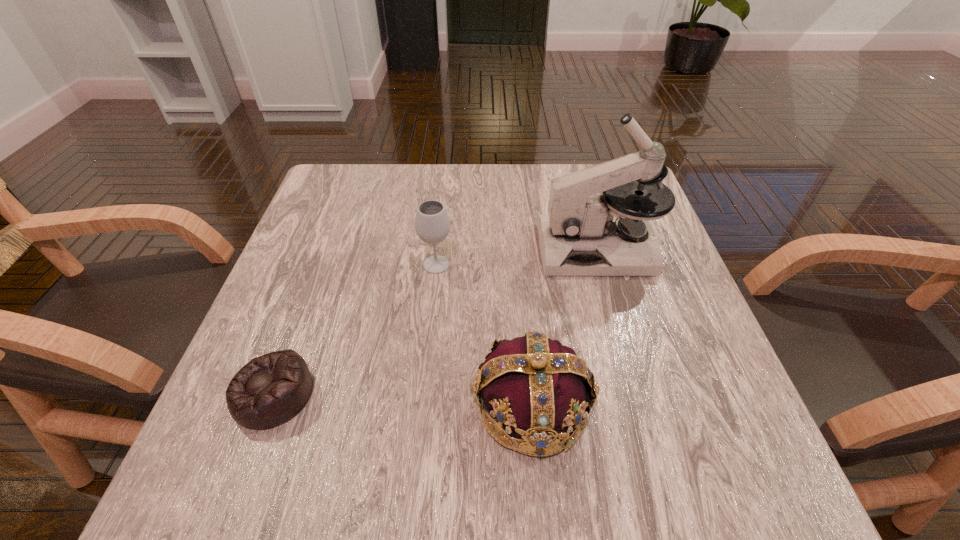
At what (x,y) coordinates should I click in order to perform the action: click on vacant space at the far right corner of the desktop. Please return your answer as a coordinate pair (x, y). The image size is (960, 540). Looking at the image, I should click on (585, 167).

The image size is (960, 540). Identify the location of blank space at the near right corner of the desktop. (660, 483).

Where is `free spot between the crown and the third object from right to left`? free spot between the crown and the third object from right to left is located at coordinates (484, 335).

Locate an element on the screen. This screenshot has width=960, height=540. free space between the microscope and the shortest object is located at coordinates point(436,321).

At what (x,y) coordinates should I click in order to perform the action: click on free area in between the microscope and the leftmost object. Please return your answer as a coordinate pair (x, y). The width and height of the screenshot is (960, 540). Looking at the image, I should click on (436, 321).

You are a GUI agent. You are given a task and a screenshot of the screen. Output one action in this format:
    pyautogui.click(x=<x>, y=<y>)
    Task: Click on the vacant area between the beanbag and the microscope
    The width and height of the screenshot is (960, 540).
    Given the screenshot: What is the action you would take?
    pyautogui.click(x=436, y=321)

In order to click on free space between the tallest object and the wineglass in this screenshot , I will do `click(516, 257)`.

Find the location of a particular element. Image resolution: width=960 pixels, height=540 pixels. vacant area between the leftmost object and the crown is located at coordinates (402, 399).

At what (x,y) coordinates should I click in order to perform the action: click on vacant area that lies between the wineglass and the tallest object. Please return your answer as a coordinate pair (x, y). This screenshot has width=960, height=540. Looking at the image, I should click on (516, 257).

In order to click on vacant space in between the second object from left to right and the tallest object in this screenshot , I will do `click(516, 257)`.